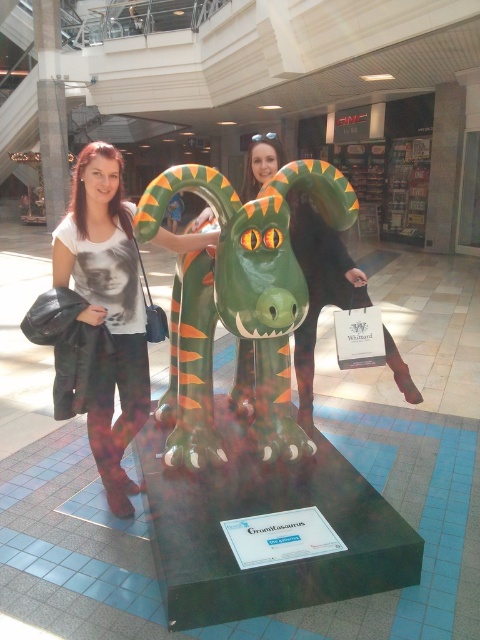
Which is behind, point (183, 285) or point (82, 246)?

The point (183, 285) is more distant.

Where is `green rubber dragon at center`? green rubber dragon at center is located at coordinates (253, 300).

The image size is (480, 640). Identify the location of green rubber dragon at center. (253, 300).